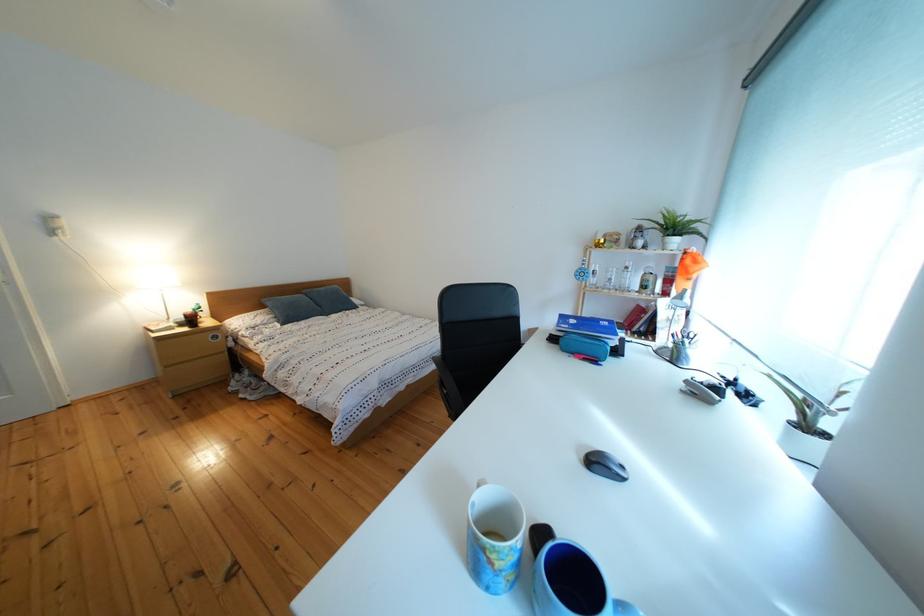
At what (x,y) coordinates should I click in order to perform the action: click on patterned white mug. Please return your answer as a coordinate pair (x, y). This screenshot has width=924, height=616. Looking at the image, I should click on (494, 538).